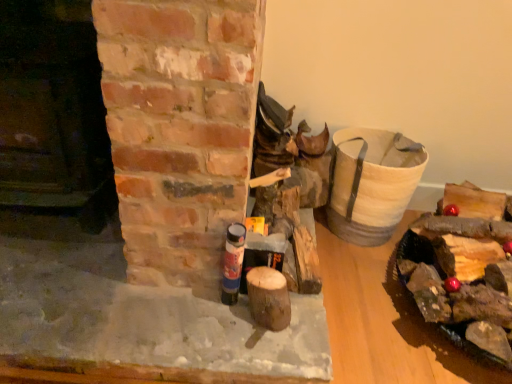
Question: From a real-world perspective, is smooth dark brown wood at left, placed as the 2th fireplace when sorted from bottom to top, under wooden logs at right?

Choices:
 (A) no
 (B) yes

Answer: (A)

Question: Could you tell me if smooth dark brown wood at left, placed as the 2th fireplace when sorted from bottom to top, is turned towards wooden logs at right?

Choices:
 (A) no
 (B) yes

Answer: (A)

Question: Does smooth dark brown wood at left, placed as the 2th fireplace when sorted from bottom to top, have a greater width compared to wooden logs at right?

Choices:
 (A) yes
 (B) no

Answer: (B)

Question: Is smooth dark brown wood at left, which ranks as the 1th fireplace in top-to-bottom order, directly adjacent to wooden logs at right?

Choices:
 (A) yes
 (B) no

Answer: (B)

Question: Is the depth of smooth dark brown wood at left, which ranks as the 1th fireplace in top-to-bottom order, less than that of wooden logs at right?

Choices:
 (A) yes
 (B) no

Answer: (A)

Question: From the image's perspective, is smooth dark brown wood at left, placed as the 2th fireplace when sorted from bottom to top, below wooden logs at right?

Choices:
 (A) yes
 (B) no

Answer: (B)

Question: From the image's perspective, would you say smooth brick fireplace at center, the second fireplace in the top-to-bottom sequence, is positioned over wooden logs at right?

Choices:
 (A) no
 (B) yes

Answer: (B)

Question: Is smooth brick fireplace at center, the second fireplace in the top-to-bottom sequence, facing towards wooden logs at right?

Choices:
 (A) yes
 (B) no

Answer: (B)

Question: Does smooth brick fireplace at center, the second fireplace in the top-to-bottom sequence, have a lesser width compared to wooden logs at right?

Choices:
 (A) no
 (B) yes

Answer: (A)

Question: Does smooth brick fireplace at center, the second fireplace in the top-to-bottom sequence, touch wooden logs at right?

Choices:
 (A) no
 (B) yes

Answer: (A)

Question: From a real-world perspective, is smooth brick fireplace at center, the second fireplace in the top-to-bottom sequence, under wooden logs at right?

Choices:
 (A) no
 (B) yes

Answer: (B)

Question: Does smooth brick fireplace at center, which appears as the first fireplace when ordered from the bottom, come in front of wooden logs at right?

Choices:
 (A) yes
 (B) no

Answer: (B)

Question: From a real-world perspective, is blue matte spray can at center beneath wooden logs at right?

Choices:
 (A) no
 (B) yes

Answer: (A)